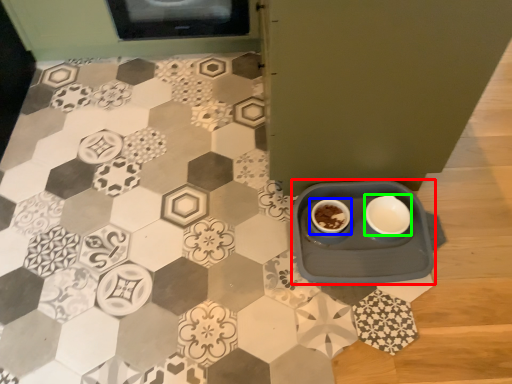
Question: Estimate the real-world distances between objects in this image. Which object is farther from table (highlighted by a red box), coffee cup (highlighted by a blue box) or tableware (highlighted by a green box)?

Choices:
 (A) coffee cup
 (B) tableware

Answer: (A)